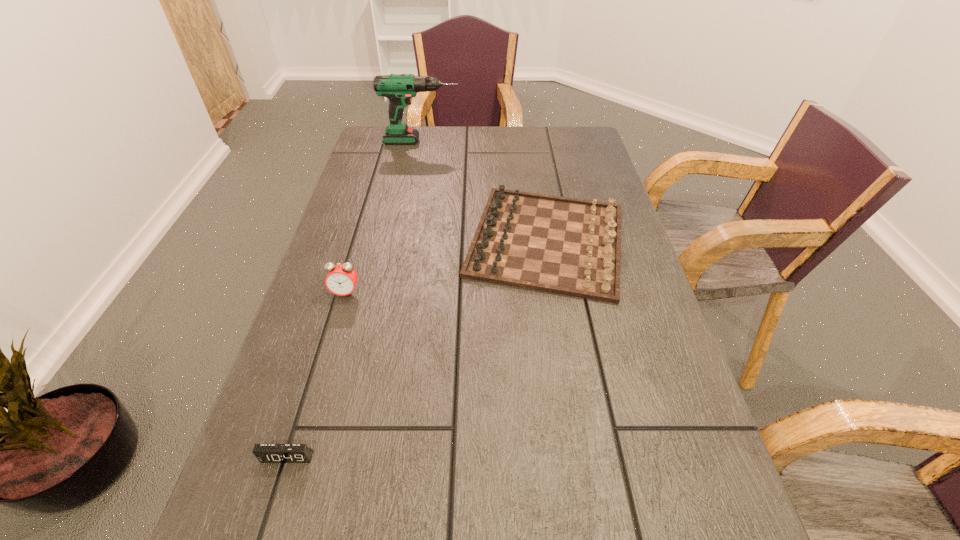
Locate an element on the screen. The image size is (960, 540). free space between the drill and the nearest object is located at coordinates (354, 299).

This screenshot has width=960, height=540. What are the coordinates of `free space that is in between the farther alarm clock and the chessboard` in the screenshot? It's located at (446, 267).

You are a GUI agent. You are given a task and a screenshot of the screen. Output one action in this format:
    pyautogui.click(x=<x>, y=<y>)
    Task: Click on the vacant point located between the rightmost object and the drill
    
    Given the screenshot: What is the action you would take?
    pyautogui.click(x=484, y=191)

At what (x,y) coordinates should I click in order to perform the action: click on free space between the farther alarm clock and the drill. Please return your answer as a coordinate pair (x, y). The image size is (960, 540). Looking at the image, I should click on (384, 217).

Where is `free space that is in between the shortest object and the farthest object`? The height and width of the screenshot is (540, 960). free space that is in between the shortest object and the farthest object is located at coordinates (354, 299).

At what (x,y) coordinates should I click in order to perform the action: click on free area in between the taller alarm clock and the chessboard. Please return your answer as a coordinate pair (x, y). The image size is (960, 540). Looking at the image, I should click on (446, 267).

The height and width of the screenshot is (540, 960). Identify the location of free space between the rightmost object and the taller alarm clock. (446, 267).

Identify the location of free space between the farthest object and the chessboard. The height and width of the screenshot is (540, 960). (484, 191).

This screenshot has width=960, height=540. In order to click on free area in between the farthest object and the rightmost object in this screenshot , I will do `click(484, 191)`.

At what (x,y) coordinates should I click in order to perform the action: click on object that stands as the second closest to the farther alarm clock. Please return your answer as a coordinate pair (x, y). The image size is (960, 540). Looking at the image, I should click on point(266,453).